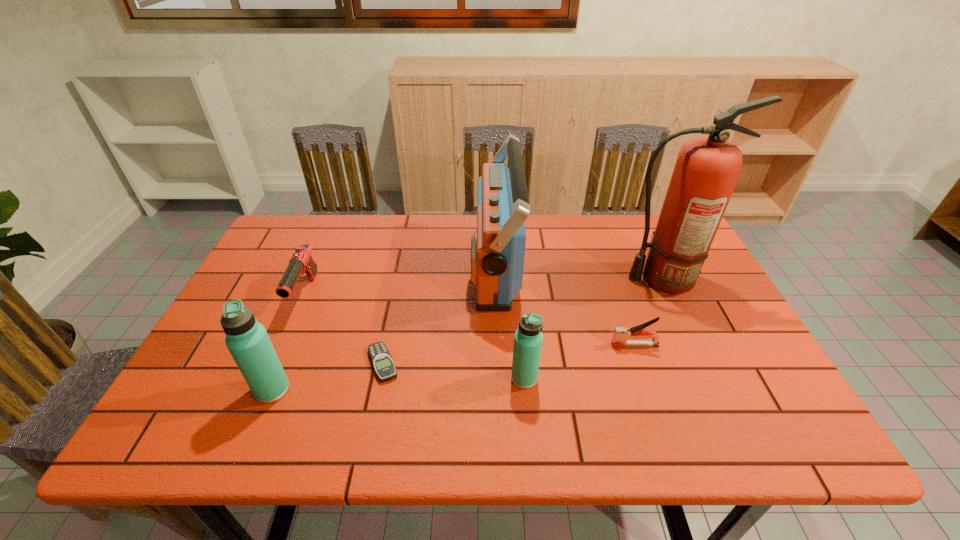
Choose which object is the third nearest neighbor to the fifth shortest object. Please provide its 2D coordinates. Your answer should be formatted as a tuple, i.e. [(x, y)], where the tuple contains the x and y coordinates of a point satisfying the conditions above.

[(498, 246)]

Locate which object ranks fourth in proximity to the shortest object. Please provide its 2D coordinates. Your answer should be formatted as a tuple, i.e. [(x, y)], where the tuple contains the x and y coordinates of a point satisfying the conditions above.

[(528, 338)]

You are a GUI agent. You are given a task and a screenshot of the screen. Output one action in this format:
    pyautogui.click(x=<x>, y=<y>)
    Task: Click on the blank area in the image that satisfies the following two spatial constraints: 1. on the front-facing side of the fourth shortest object; 2. on the left side of the radio receiver
    
    Given the screenshot: What is the action you would take?
    pyautogui.click(x=499, y=378)

You are a GUI agent. You are given a task and a screenshot of the screen. Output one action in this format:
    pyautogui.click(x=<x>, y=<y>)
    Task: Click on the free region that satisfies the following two spatial constraints: 1. on the nozzle of the tallest object; 2. at the aiming end of the third shortest object
    The image size is (960, 540).
    Given the screenshot: What is the action you would take?
    pyautogui.click(x=669, y=295)

Locate an element on the screen. free spot that satisfies the following two spatial constraints: 1. at the aiming end of the left thermos bottle; 2. on the right side of the gun is located at coordinates (265, 389).

Find the location of a particular element. Image resolution: width=960 pixels, height=540 pixels. vacant space that satisfies the following two spatial constraints: 1. on the nozzle of the tallest object; 2. at the aiming end of the third shortest object is located at coordinates (669, 295).